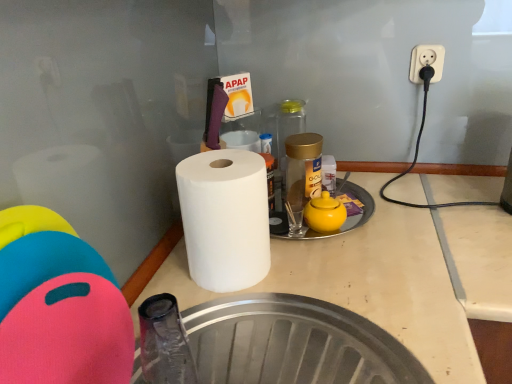
Question: Considering the relative sizes of transparent glass bottle at center, marked as the 2th bottle in a front-to-back arrangement, and white matte paper towel at center in the image provided, is transparent glass bottle at center, marked as the 2th bottle in a front-to-back arrangement, bigger than white matte paper towel at center?

Choices:
 (A) yes
 (B) no

Answer: (B)

Question: Considering the relative positions of transparent glass bottle at center, the 1th bottle from the back, and white matte paper towel at center in the image provided, is transparent glass bottle at center, the 1th bottle from the back, to the left of white matte paper towel at center from the viewer's perspective?

Choices:
 (A) yes
 (B) no

Answer: (B)

Question: Does transparent glass bottle at center, marked as the 2th bottle in a front-to-back arrangement, appear on the right side of white matte paper towel at center?

Choices:
 (A) yes
 (B) no

Answer: (A)

Question: Is transparent glass bottle at center, marked as the 2th bottle in a front-to-back arrangement, directly adjacent to white matte paper towel at center?

Choices:
 (A) yes
 (B) no

Answer: (B)

Question: Could you tell me if transparent glass bottle at center, the 1th bottle from the back, is turned towards white matte paper towel at center?

Choices:
 (A) yes
 (B) no

Answer: (B)

Question: Can you confirm if transparent glass bottle at center, marked as the 2th bottle in a front-to-back arrangement, is thinner than white matte paper towel at center?

Choices:
 (A) no
 (B) yes

Answer: (B)

Question: Is transparent glass bottle at center, marked as the 2th bottle in a front-to-back arrangement, at the back of gold metallic jar at center, which appears as the second bottle when viewed from the back?

Choices:
 (A) yes
 (B) no

Answer: (B)

Question: Is gold metallic jar at center, which appears as the second bottle when viewed from the back, closer to camera compared to transparent glass bottle at center, marked as the 2th bottle in a front-to-back arrangement?

Choices:
 (A) no
 (B) yes

Answer: (B)

Question: Does gold metallic jar at center, the 1th bottle positioned from the front, turn towards transparent glass bottle at center, marked as the 2th bottle in a front-to-back arrangement?

Choices:
 (A) yes
 (B) no

Answer: (B)

Question: From the image's perspective, is gold metallic jar at center, the 1th bottle positioned from the front, located above transparent glass bottle at center, the 1th bottle from the back?

Choices:
 (A) no
 (B) yes

Answer: (A)

Question: From the image's perspective, is gold metallic jar at center, which appears as the second bottle when viewed from the back, under transparent glass bottle at center, the 1th bottle from the back?

Choices:
 (A) yes
 (B) no

Answer: (A)

Question: Is gold metallic jar at center, which appears as the second bottle when viewed from the back, outside transparent glass bottle at center, marked as the 2th bottle in a front-to-back arrangement?

Choices:
 (A) yes
 (B) no

Answer: (A)

Question: Is white matte paper towel at center oriented towards yellow matte teapot at center?

Choices:
 (A) yes
 (B) no

Answer: (B)